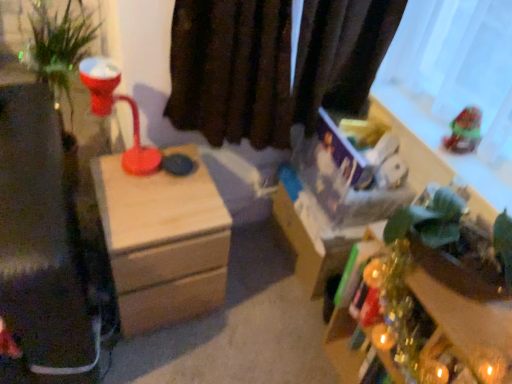
Question: Is shiny plastic toy at upper right in front of or behind wooden nightstand at center in the image?

Choices:
 (A) front
 (B) behind

Answer: (B)

Question: Is point (479, 135) closer or farther from the camera than point (134, 281)?

Choices:
 (A) closer
 (B) farther

Answer: (A)

Question: Which object is positioned farthest from the shiny plastic toy at upper right?

Choices:
 (A) green matte plant at lower right
 (B) wooden nightstand at center

Answer: (B)

Question: Based on their relative distances, which object is farther from the wooden nightstand at center?

Choices:
 (A) green matte plant at lower right
 (B) shiny plastic toy at upper right

Answer: (B)